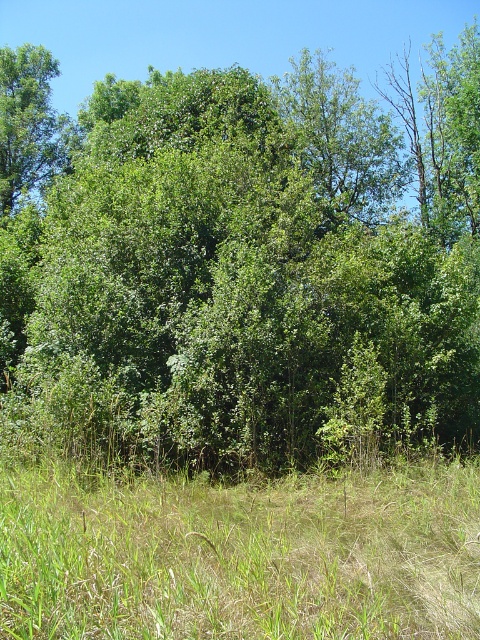
You are standing at the camera position and want to reach the point at coordinates point (196, 115). Can you walk directly to it without any obstacles?

The distance of point (196, 115) from camera is 51.18 feet, so yes, you can walk directly to it since there are no obstacles mentioned in the scene description.

You are a hiker carrying a 10 meter long rope. You want to tie the rope between the green leafy tree at center and the green leafy tree at upper left. Is the rope long enough to reach between them?

The distance between the green leafy tree at center and the green leafy tree at upper left is 12.42 meters. Since the rope is only 10 meters long, it is not long enough to span the distance between them.